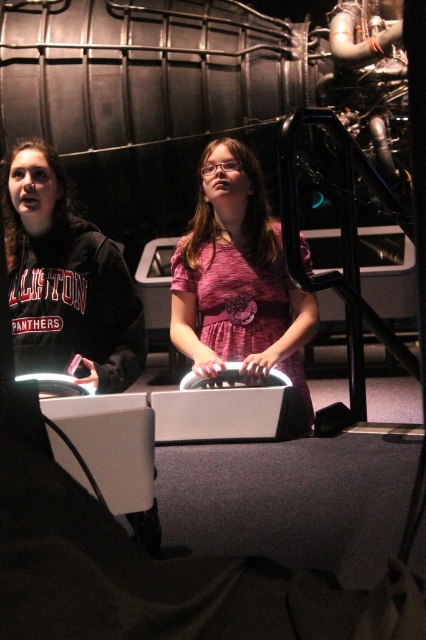
Question: Among these points, which one is nearest to the camera?

Choices:
 (A) (31, 179)
 (B) (215, 358)

Answer: (A)

Question: Is pink fabric dress at center below matte black hoodie at left?

Choices:
 (A) yes
 (B) no

Answer: (A)

Question: Is pink fabric dress at center further to camera compared to matte black hoodie at left?

Choices:
 (A) no
 (B) yes

Answer: (B)

Question: Is pink fabric dress at center to the right of matte black hoodie at left from the viewer's perspective?

Choices:
 (A) yes
 (B) no

Answer: (A)

Question: Among these points, which one is nearest to the camera?

Choices:
 (A) (247, 177)
 (B) (54, 157)

Answer: (B)